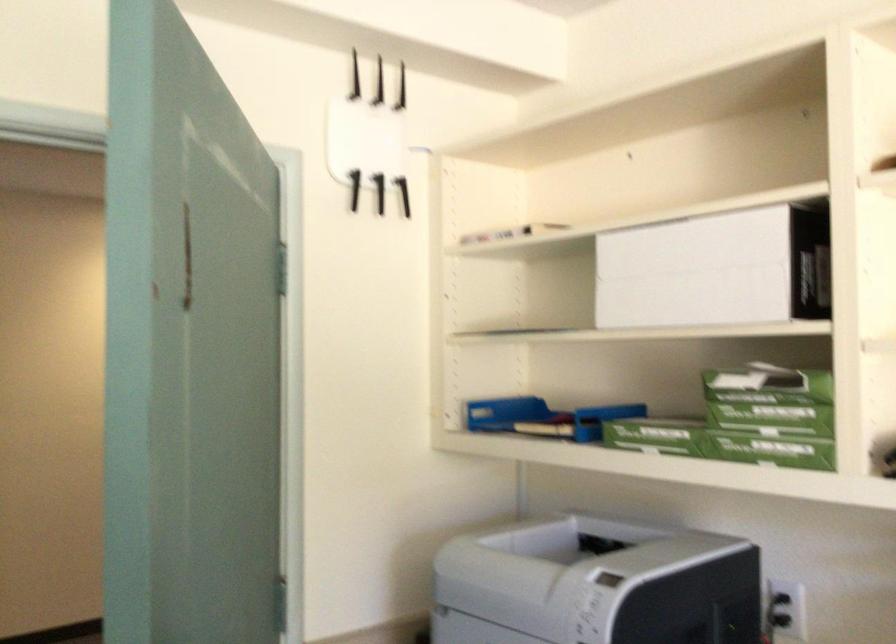
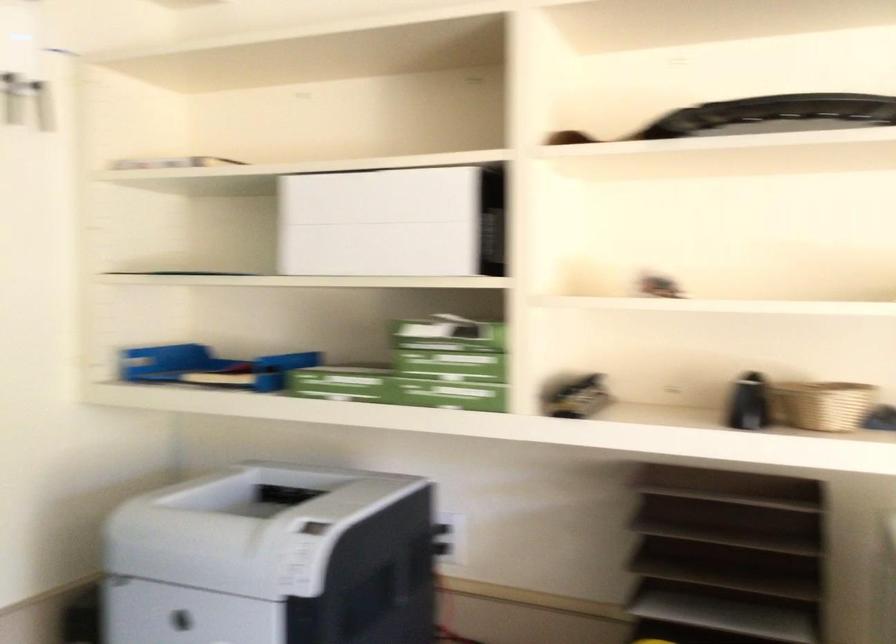
Locate, in the second image, the point that corresponds to (694,444) in the first image.

(382, 386)